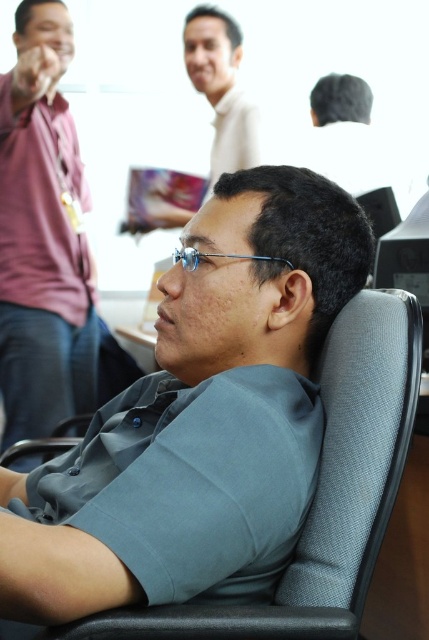
Does matte white shirt at upper center have a lesser width compared to dark gray fabric cap at upper right?

Yes.

Is matte white shirt at upper center in front of dark gray fabric cap at upper right?

Yes, matte white shirt at upper center is in front of dark gray fabric cap at upper right.

This screenshot has width=429, height=640. Describe the element at coordinates (224, 92) in the screenshot. I see `matte white shirt at upper center` at that location.

Locate an element on the screen. The width and height of the screenshot is (429, 640). matte white shirt at upper center is located at coordinates (224, 92).

Does point (383, 474) come farther from viewer compared to point (389, 186)?

No, it is not.

Between gray fabric swivel chair at center and dark gray fabric cap at upper right, which one appears on the left side from the viewer's perspective?

gray fabric swivel chair at center

From the picture: Who is more distant from viewer, [347,406] or [329,134]?

The point [329,134] is behind.

Find the location of a particular element. This screenshot has height=640, width=429. gray fabric swivel chair at center is located at coordinates tap(322, 492).

Which is behind, point (338, 588) or point (235, 72)?

The point (235, 72) is more distant.

Can you confirm if gray fabric swivel chair at center is taller than matte white shirt at upper center?

In fact, gray fabric swivel chair at center may be shorter than matte white shirt at upper center.

Does point (299, 608) come behind point (251, 148)?

No.

What are the coordinates of `gray fabric swivel chair at center` in the screenshot? It's located at (322, 492).